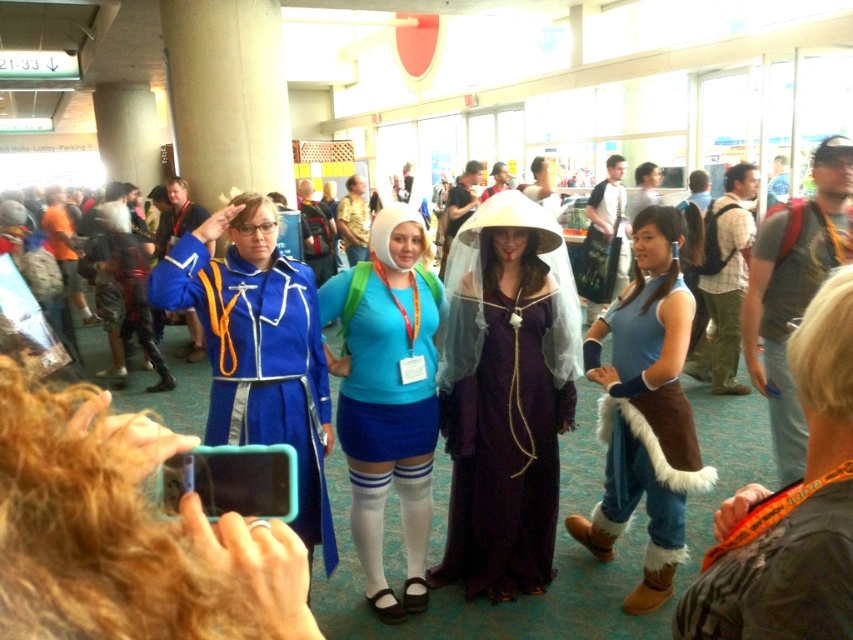
Question: Does brown fur vest at lower right appear under blue suede boots at lower right?

Choices:
 (A) no
 (B) yes

Answer: (A)

Question: Is the position of blue fabric skirt at center less distant than that of blue suede boots at lower right?

Choices:
 (A) yes
 (B) no

Answer: (B)

Question: Which object is the closest to the blue fabric skirt at center?

Choices:
 (A) purple satin dress at center
 (B) blue fabric dress at center
 (C) blue suede boots at lower right
 (D) orange lanyard at lower right

Answer: (B)

Question: Is purple satin dress at center smaller than blue suede boots at lower right?

Choices:
 (A) yes
 (B) no

Answer: (A)

Question: Estimate the real-world distances between objects in this image. Which object is closer to the blue fabric skirt at center?

Choices:
 (A) purple satin dress at center
 (B) blue suede boots at lower right

Answer: (A)

Question: Which point is farther to the camera?

Choices:
 (A) pos(621,365)
 (B) pos(444,422)
 (C) pos(428,374)
 (D) pos(836,628)

Answer: (B)